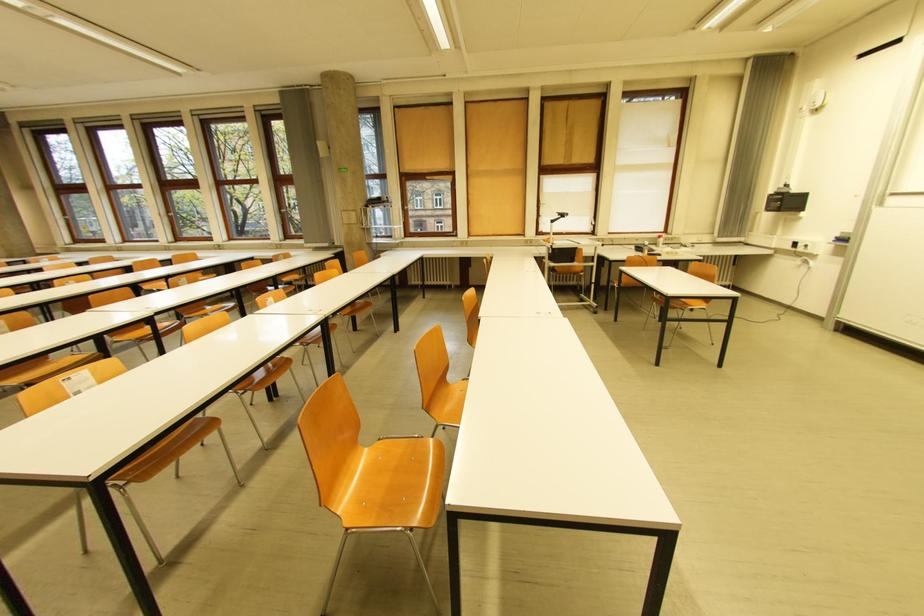
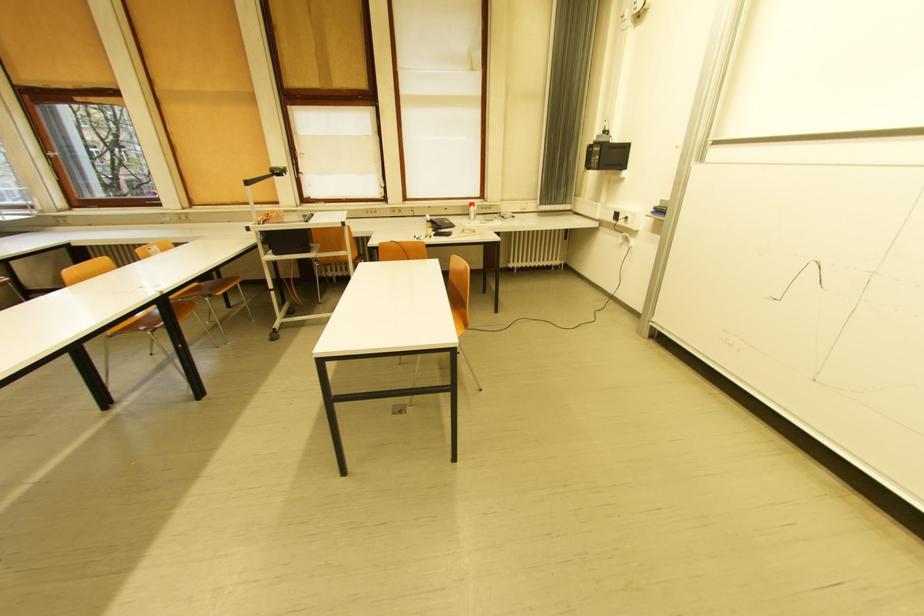
Where in the second image is the point corresponding to pixel 772 209 from the first image?

(592, 168)